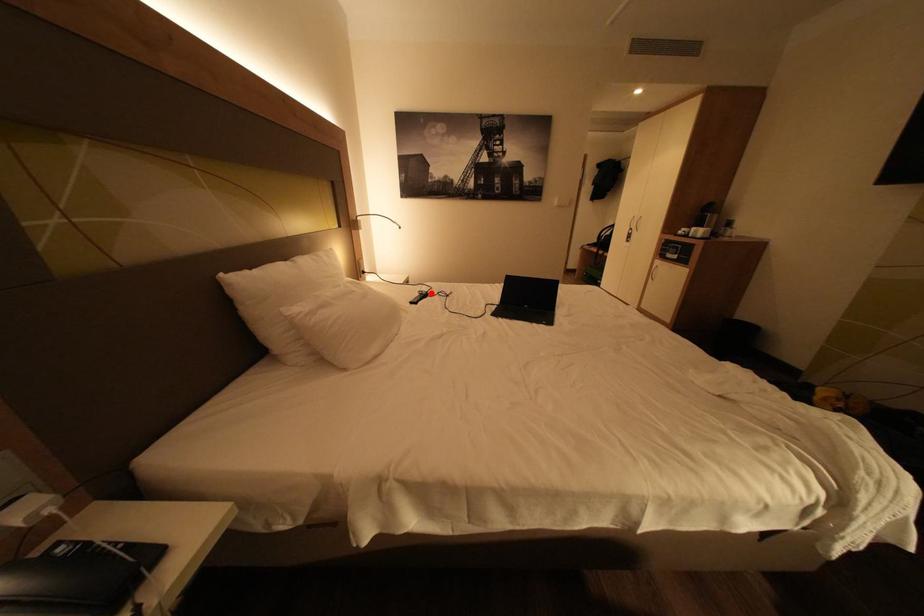
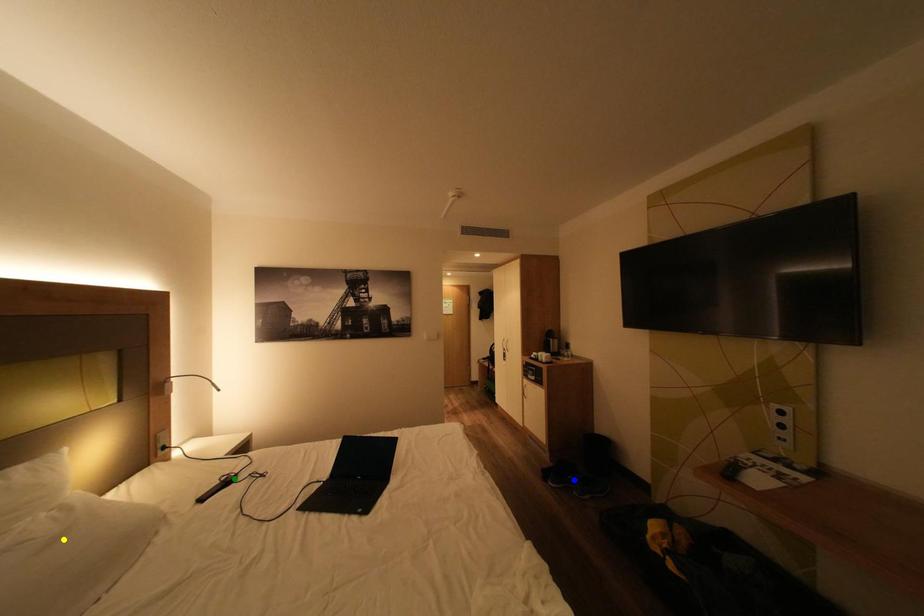
Question: I am providing you with two images of the same scene from different viewpoints. A red point is marked on the first image. You are given multiple points on the second image. In image 2, which mark is for the same physical point as the one in image 1?

Choices:
 (A) yellow point
 (B) green point
 (C) blue point

Answer: (B)